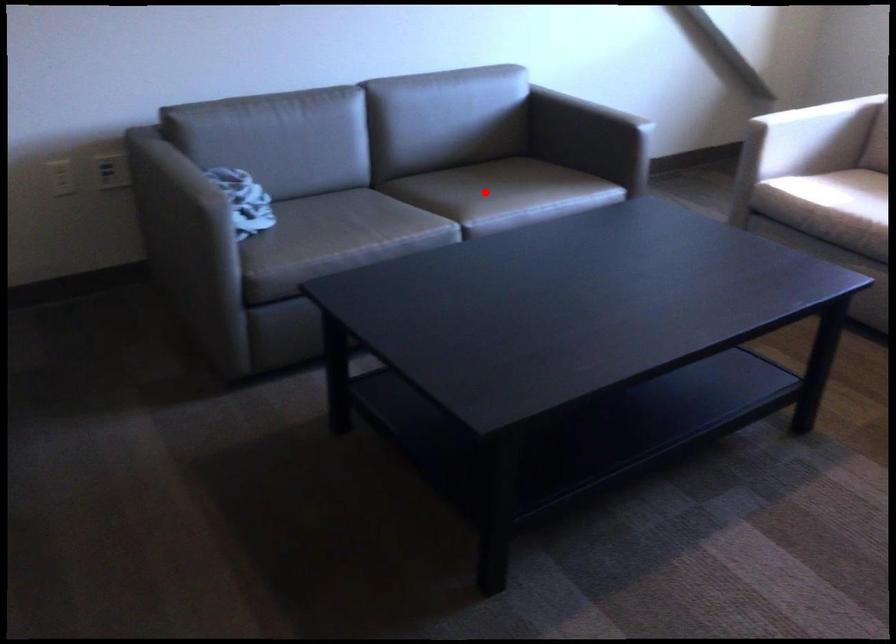
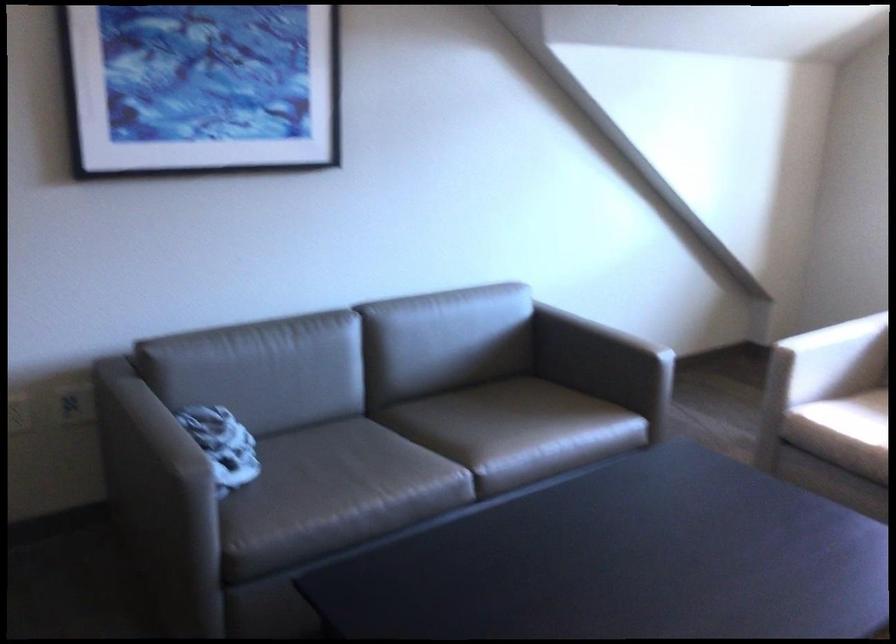
Where in the second image is the point corresponding to the highlighted location from the first image?

(497, 430)